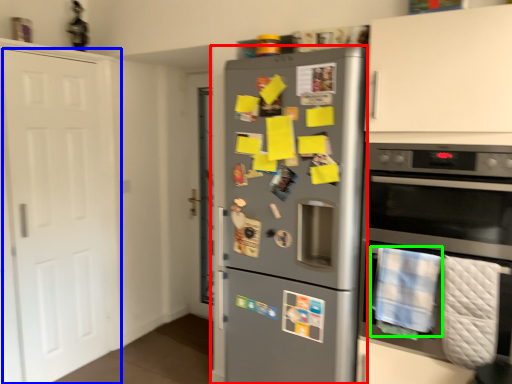
Question: Which object is positioned farthest from refrigerator (highlighted by a red box)? Select from door (highlighted by a blue box) and blanket (highlighted by a green box).

Choices:
 (A) door
 (B) blanket

Answer: (A)